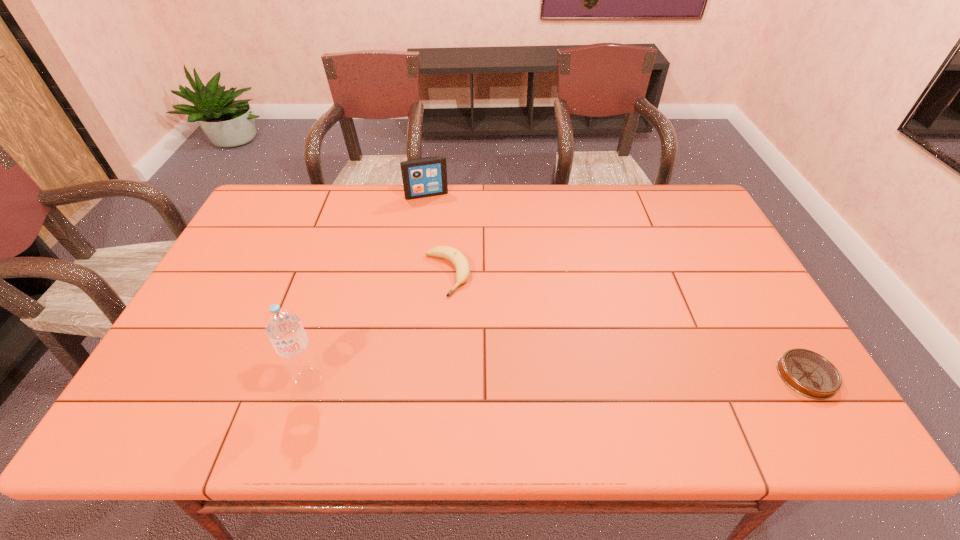
Where is `blank region between the tallest object and the banana`? blank region between the tallest object and the banana is located at coordinates (378, 327).

Image resolution: width=960 pixels, height=540 pixels. In order to click on free area in between the banana and the compass in this screenshot , I will do `click(627, 325)`.

I want to click on vacant area that lies between the second farthest object and the second tallest object, so click(x=437, y=234).

The image size is (960, 540). I want to click on free point between the tallest object and the second farthest object, so click(378, 327).

This screenshot has height=540, width=960. Find the location of `free space between the farthest object and the shortest object`. free space between the farthest object and the shortest object is located at coordinates (616, 285).

Identify the location of free space between the third tallest object and the rightmost object. (627, 325).

Identify the location of vacant point located between the water bottle and the second tallest object. (368, 287).

Identify which object is the third closest to the banana. Please provide its 2D coordinates. Your answer should be formatted as a tuple, i.e. [(x, y)], where the tuple contains the x and y coordinates of a point satisfying the conditions above.

[(808, 373)]

The image size is (960, 540). I want to click on object that is the closest one to the water bottle, so click(x=461, y=264).

You are a GUI agent. You are given a task and a screenshot of the screen. Output one action in this format:
    pyautogui.click(x=<x>, y=<y>)
    Task: Click on the vacant area in the image that satisfies the following two spatial constraints: 1. on the front side of the second shortest object; 2. on the right side of the second tallest object
    This screenshot has width=960, height=540.
    Given the screenshot: What is the action you would take?
    pyautogui.click(x=415, y=274)